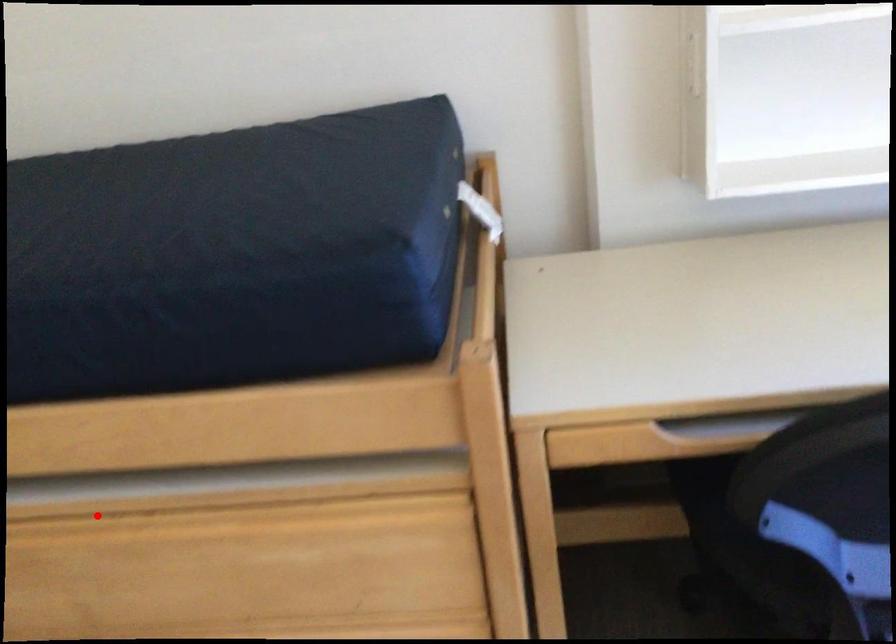
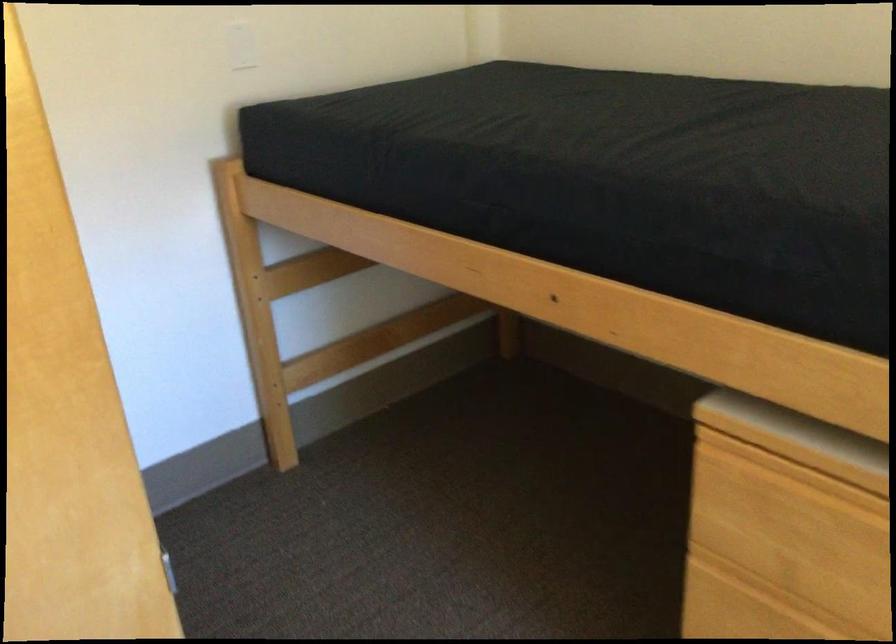
Locate, in the second image, the point that corresponds to the highlighted location in the first image.

(837, 474)